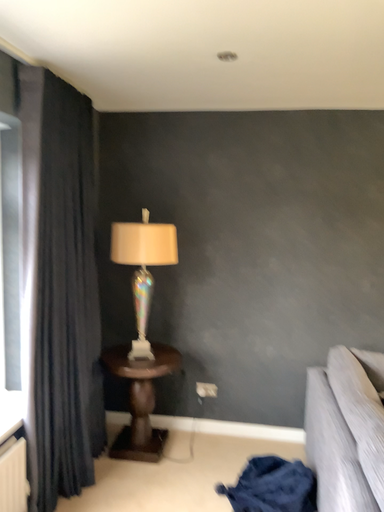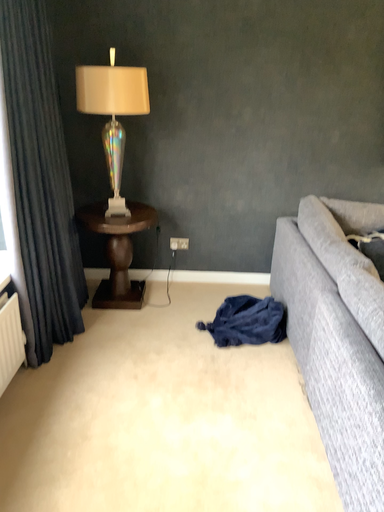
Question: How did the camera likely rotate when shooting the video?

Choices:
 (A) rotated right
 (B) rotated left

Answer: (A)